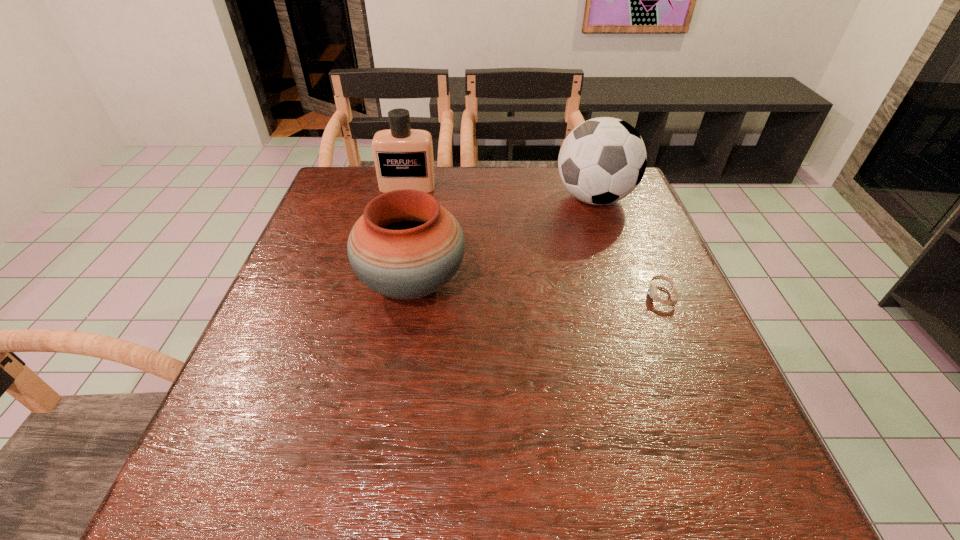
Locate an element on the screen. free space located 0.070m on the face of the watch is located at coordinates (617, 295).

Where is `vacant space located 0.130m on the face of the watch`? The width and height of the screenshot is (960, 540). vacant space located 0.130m on the face of the watch is located at coordinates (589, 295).

Identify the location of soccer ball that is at the far edge. This screenshot has width=960, height=540. (602, 160).

Locate an element on the screen. perfume present at the far edge is located at coordinates click(x=403, y=157).

In order to click on object located at the left edge in this screenshot , I will do `click(403, 157)`.

At what (x,y) coordinates should I click in order to perform the action: click on soccer ball that is at the right edge. Please return your answer as a coordinate pair (x, y). This screenshot has width=960, height=540. Looking at the image, I should click on tap(602, 160).

You are a GUI agent. You are given a task and a screenshot of the screen. Output one action in this format:
    pyautogui.click(x=<x>, y=<y>)
    Task: Click on the watch positioned at the right edge
    
    Given the screenshot: What is the action you would take?
    pyautogui.click(x=652, y=289)

Where is `object that is at the far left corner`? object that is at the far left corner is located at coordinates (403, 157).

Locate an element on the screen. This screenshot has width=960, height=540. object present at the far right corner is located at coordinates (602, 160).

At what (x,y) coordinates should I click in order to perform the action: click on vacant space at the far edge of the desktop. Please return your answer as a coordinate pair (x, y). This screenshot has width=960, height=540. Looking at the image, I should click on (540, 186).